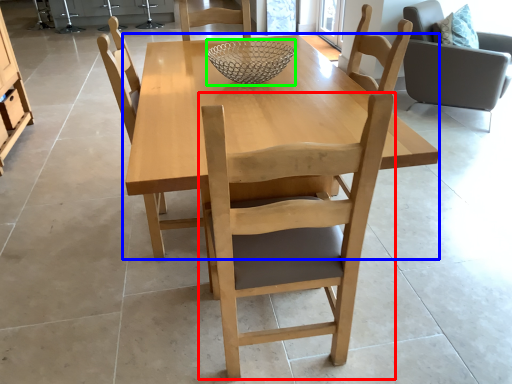
Question: Based on their relative distances, which object is nearer to chair (highlighted by a red box)? Choose from kitchen & dining room table (highlighted by a blue box) and glass bowl (highlighted by a green box).

Choices:
 (A) kitchen & dining room table
 (B) glass bowl

Answer: (A)